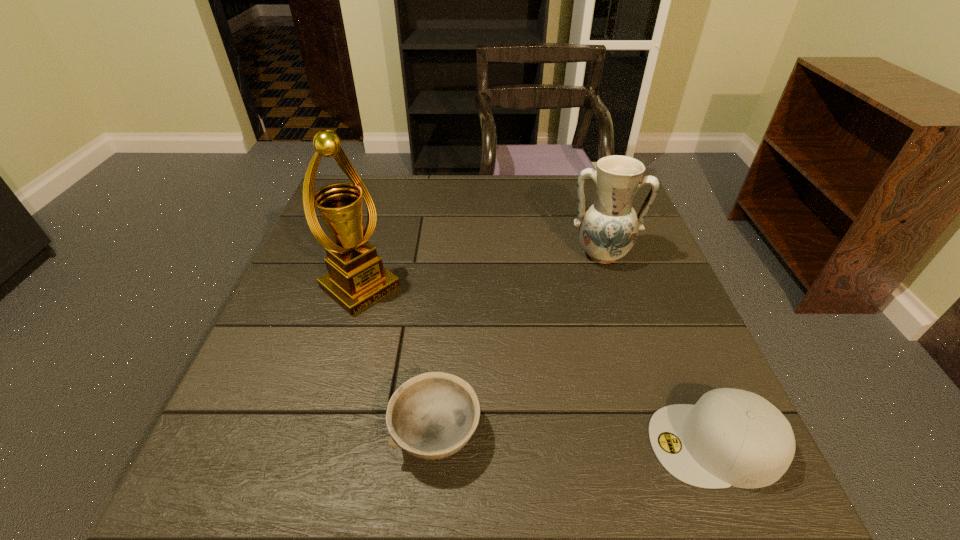
This screenshot has width=960, height=540. In order to click on bowl in this screenshot , I will do `click(433, 415)`.

You are a GUI agent. You are given a task and a screenshot of the screen. Output one action in this format:
    pyautogui.click(x=<x>, y=<y>)
    Task: Click on the shortest object
    This screenshot has height=540, width=960.
    Given the screenshot: What is the action you would take?
    pyautogui.click(x=433, y=415)

Where is `the second shortest object`? the second shortest object is located at coordinates (731, 437).

The image size is (960, 540). What are the coordinates of `the third shortest object` in the screenshot? It's located at 608,227.

The height and width of the screenshot is (540, 960). I want to click on the tallest object, so click(x=356, y=279).

You are a GUI agent. You are given a task and a screenshot of the screen. Output one action in this format:
    pyautogui.click(x=<x>, y=<y>)
    Task: Click on the award
    
    Given the screenshot: What is the action you would take?
    pyautogui.click(x=356, y=279)

At what (x,y) coordinates should I click in order to perform the action: click on free space located on the right of the shortest object. Please return your answer as a coordinate pair (x, y). Looking at the image, I should click on (684, 434).

You are a GUI agent. You are given a task and a screenshot of the screen. Output one action in this format:
    pyautogui.click(x=<x>, y=<y>)
    Task: Click on the free space located 0.330m on the front-facing side of the cap
    The width and height of the screenshot is (960, 540).
    Given the screenshot: What is the action you would take?
    pyautogui.click(x=460, y=444)

Locate an element on the screen. The height and width of the screenshot is (540, 960). vacant position located 0.280m on the front-facing side of the cap is located at coordinates (489, 444).

Identify the location of vacant space located on the front-facing side of the cap. (523, 444).